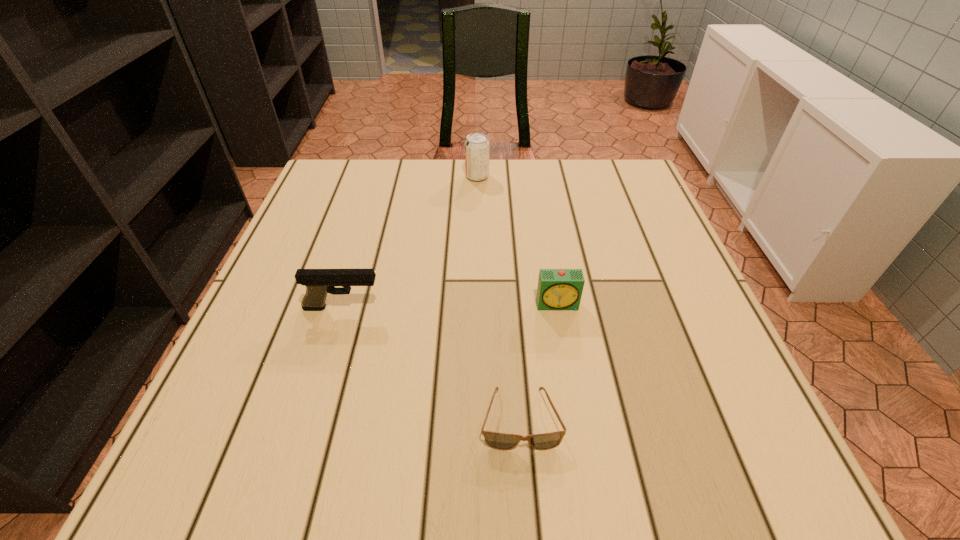
Identify the location of unoccupied area between the sunglasses and the alarm clock. pos(540,362).

The image size is (960, 540). Find the location of `vacant area between the sunglasses and the alarm clock`. vacant area between the sunglasses and the alarm clock is located at coordinates (540, 362).

This screenshot has width=960, height=540. Identify the location of free space between the farthest object and the alarm clock. 517,240.

Locate an element on the screen. Image resolution: width=960 pixels, height=540 pixels. vacant space that is in between the sunglasses and the alarm clock is located at coordinates (540, 362).

The width and height of the screenshot is (960, 540). In order to click on free spot between the shortest object and the pistol in this screenshot , I will do `click(432, 363)`.

The image size is (960, 540). What are the coordinates of `free space between the shortest object and the farthest object` in the screenshot? It's located at [x=499, y=298].

Where is `free space between the soda can and the second shortest object`? This screenshot has width=960, height=540. free space between the soda can and the second shortest object is located at coordinates (517, 240).

Choose which object is the second nearest neighbor to the shortest object. Please provide its 2D coordinates. Your answer should be formatted as a tuple, i.e. [(x, y)], where the tuple contains the x and y coordinates of a point satisfying the conditions above.

[(319, 282)]

Find the location of a particular element. The height and width of the screenshot is (540, 960). the second closest object to the sunglasses is located at coordinates (319, 282).

The width and height of the screenshot is (960, 540). What are the coordinates of `vacant point that satisfies the following two spatial constraints: 1. on the front-facing side of the second shortest object; 2. on the front-facing side of the pistol` in the screenshot? It's located at (559, 308).